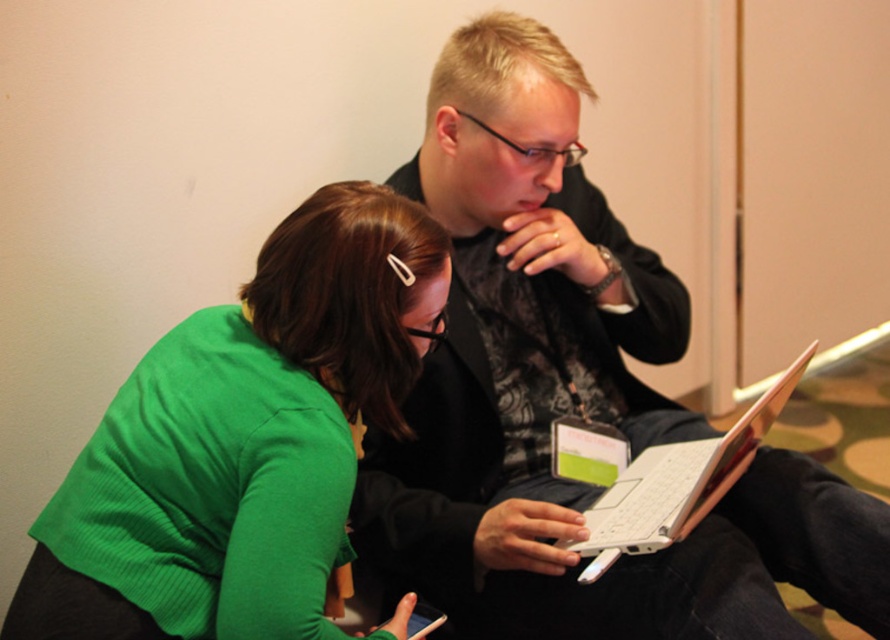
Question: Does black matte laptop at center have a lesser width compared to white plastic laptop at center?

Choices:
 (A) yes
 (B) no

Answer: (B)

Question: Among these points, which one is farthest from the camera?

Choices:
 (A) (742, 445)
 (B) (67, 548)
 (C) (642, 404)

Answer: (C)

Question: Which point appears closest to the camera in this image?

Choices:
 (A) (514, 449)
 (B) (290, 406)
 (C) (604, 499)

Answer: (B)

Question: Is black matte laptop at center above white plastic laptop at center?

Choices:
 (A) no
 (B) yes

Answer: (B)

Question: Which point is farther to the camera?

Choices:
 (A) white plastic laptop at center
 (B) black matte laptop at center

Answer: (B)

Question: Does black matte laptop at center come behind white plastic laptop at center?

Choices:
 (A) yes
 (B) no

Answer: (A)